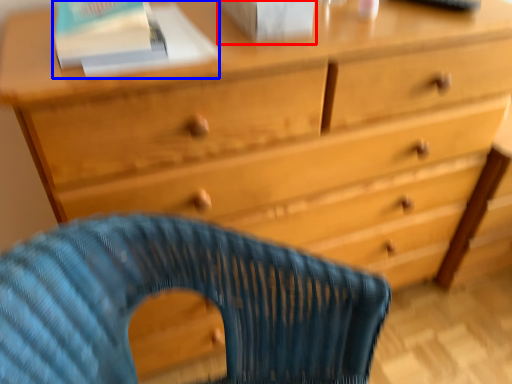
Question: Among these objects, which one is farthest to the camera, paperback book (highlighted by a red box) or paperback book (highlighted by a blue box)?

Choices:
 (A) paperback book
 (B) paperback book

Answer: (B)